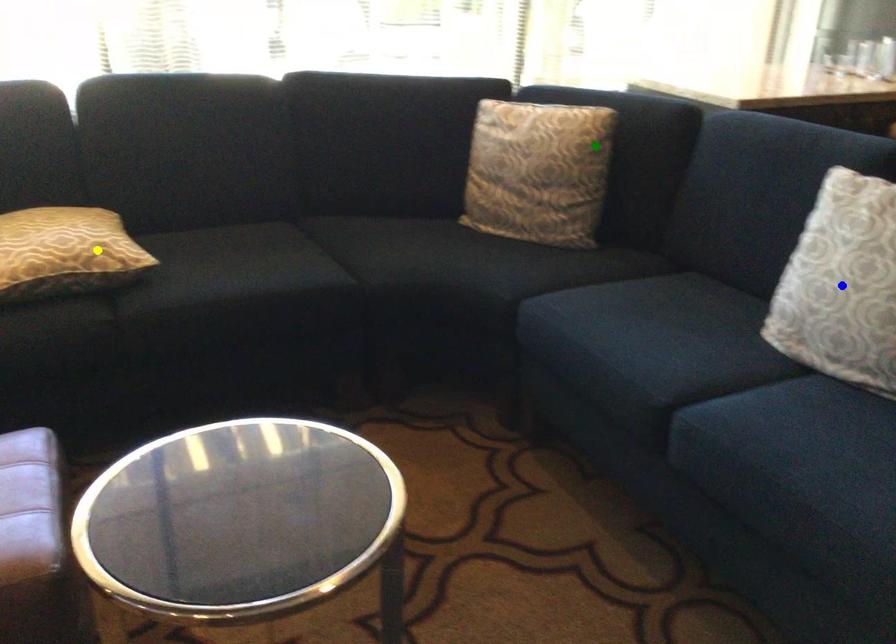
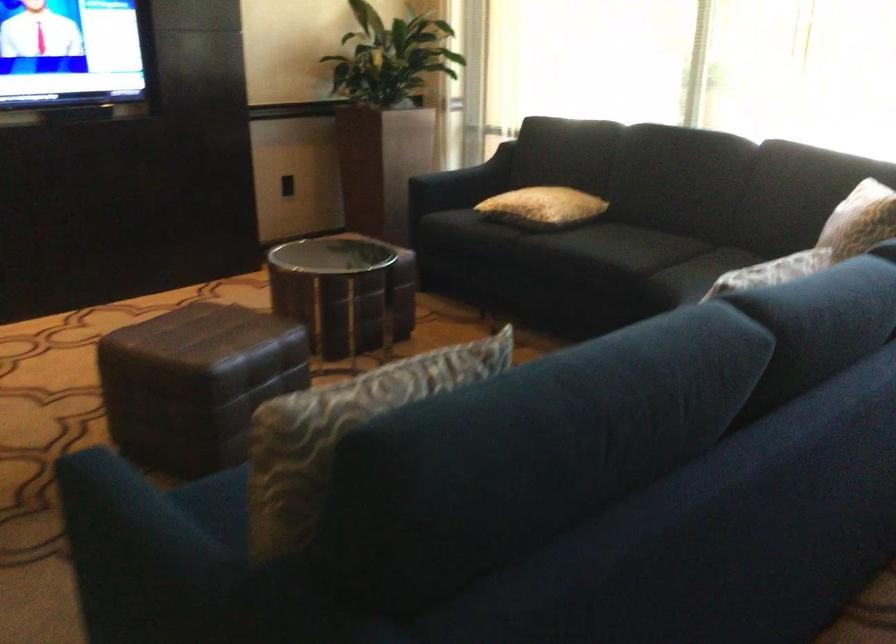
I am providing you with two images of the same scene from different viewpoints. Three points are marked in image1. Which point corresponds to a part or object that is occluded in image2?In image1, three points are marked. Which of them correspond to a part or object that is occluded in image2?Among the three points shown in image1, which one corresponds to a part or object that is no longer visible due to occlusion in image2?

Invisible in image2: blue point.